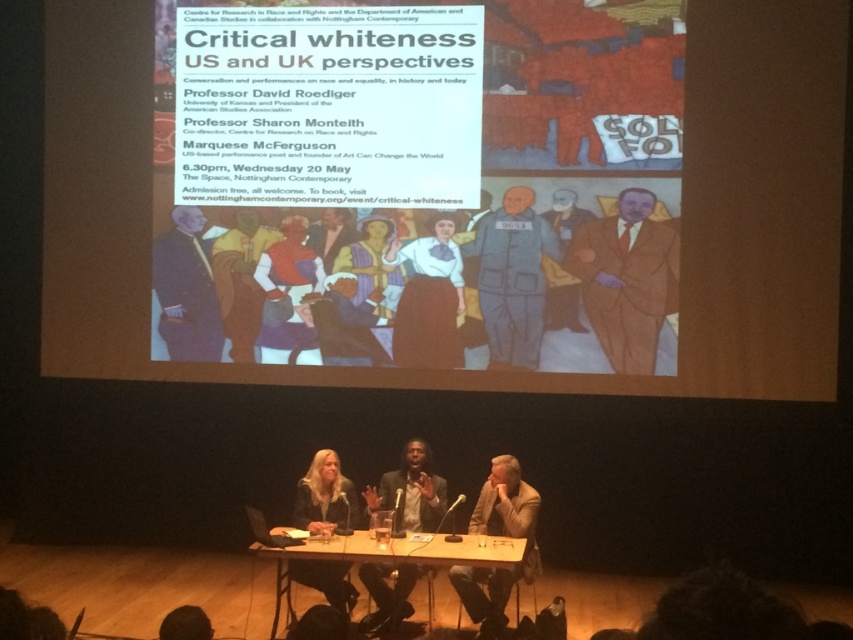
You are a photographer at the back of the audience. You want to take a photo of the brown textured suit at right and the wooden at center. Which object will appear bigger in your photo?

The brown textured suit at right will appear bigger in the photo because it is larger in size than the wooden at center.

Where is the brown textured suit at right located in the image?

The brown textured suit at right is located at point coordinates of 0.436 on the x axis and 0.735 on the y axis.

What is the 2D coordinate of the matte paper poster at center?

The matte paper poster at center is located at the 2D coordinate point of (x=453, y=186).